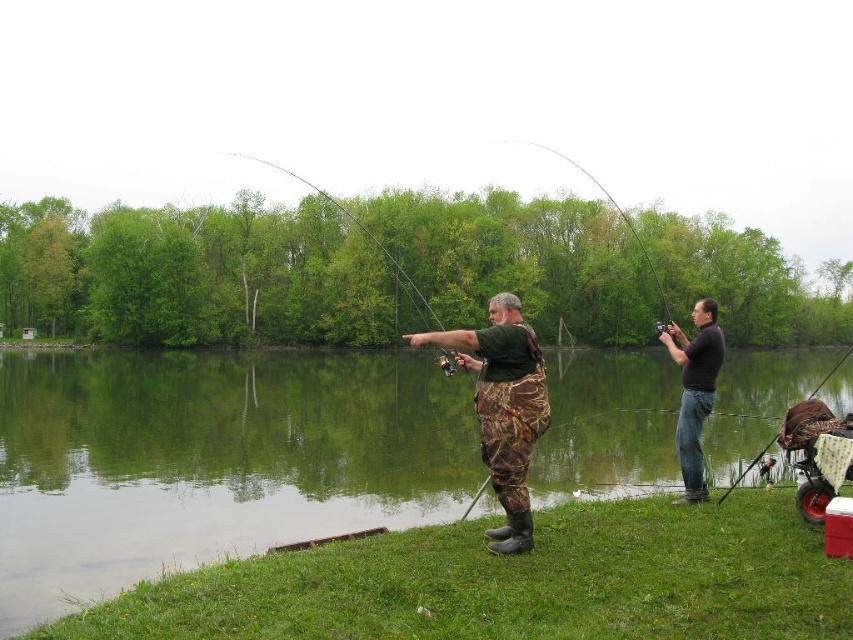
Does camouflage fabric fishing rod at center appear on the right side of matte black fishing pole at right?

Incorrect, camouflage fabric fishing rod at center is not on the right side of matte black fishing pole at right.

Can you confirm if camouflage fabric fishing rod at center is taller than matte black fishing pole at right?

Correct, camouflage fabric fishing rod at center is much taller as matte black fishing pole at right.

Image resolution: width=853 pixels, height=640 pixels. Describe the element at coordinates (346, 216) in the screenshot. I see `camouflage fabric fishing rod at center` at that location.

At what (x,y) coordinates should I click in order to perform the action: click on camouflage fabric fishing rod at center. Please return your answer as a coordinate pair (x, y). The height and width of the screenshot is (640, 853). Looking at the image, I should click on (346, 216).

Who is more distant from viewer, (503, 490) or (848, 348)?

Point (848, 348)

Is camouflage pants at center further to camera compared to matte black fishing pole at right?

No.

Is point (502, 296) farther from camera compared to point (827, 380)?

No, it is in front of (827, 380).

Where is `camouflage pants at center`? This screenshot has width=853, height=640. camouflage pants at center is located at coordinates (503, 406).

Which is more to the right, camouflage fabric fishing rod at center or shiny metallic rod at upper center?

From the viewer's perspective, shiny metallic rod at upper center appears more on the right side.

Can you confirm if camouflage fabric fishing rod at center is wider than shiny metallic rod at upper center?

Indeed, camouflage fabric fishing rod at center has a greater width compared to shiny metallic rod at upper center.

Measure the distance between point (248, 154) and camera.

They are 192.46 meters apart.

You are a GUI agent. You are given a task and a screenshot of the screen. Output one action in this format:
    pyautogui.click(x=<x>, y=<y>)
    Task: Click on the camouflage fabric fishing rod at center
    This screenshot has height=640, width=853.
    Given the screenshot: What is the action you would take?
    pyautogui.click(x=346, y=216)